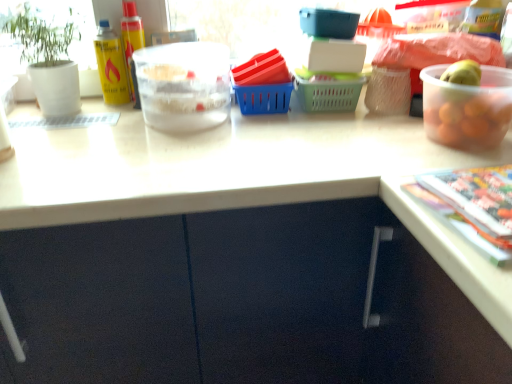
Question: From a real-world perspective, is transparent plastic bowl at upper right, placed as the first bowl when sorted from right to left, positioned under translucent plastic bowl at upper center, marked as the second bowl in a right-to-left arrangement, based on gravity?

Choices:
 (A) yes
 (B) no

Answer: (B)

Question: Is translucent plastic bowl at upper center, marked as the first bowl in a back-to-front arrangement, completely or partially inside transparent plastic bowl at upper right, the 1th bowl viewed from the front?

Choices:
 (A) yes
 (B) no

Answer: (B)

Question: Is transparent plastic bowl at upper right, which is the second bowl in back-to-front order, wider than translucent plastic bowl at upper center, marked as the second bowl in a right-to-left arrangement?

Choices:
 (A) yes
 (B) no

Answer: (B)

Question: Is transparent plastic bowl at upper right, which is the second bowl in back-to-front order, oriented towards translucent plastic bowl at upper center, acting as the 1th bowl starting from the left?

Choices:
 (A) no
 (B) yes

Answer: (A)

Question: Can we say transparent plastic bowl at upper right, the 1th bowl viewed from the front, lies outside translucent plastic bowl at upper center, marked as the first bowl in a back-to-front arrangement?

Choices:
 (A) yes
 (B) no

Answer: (A)

Question: Is transparent plastic bowl at upper right, placed as the first bowl when sorted from right to left, next to translucent plastic bowl at upper center, marked as the first bowl in a back-to-front arrangement?

Choices:
 (A) no
 (B) yes

Answer: (A)

Question: From the image's perspective, is green matte plant pot at left located above translucent plastic bowl at upper center, positioned as the 2th bowl in front-to-back order?

Choices:
 (A) yes
 (B) no

Answer: (A)

Question: Can you confirm if green matte plant pot at left is bigger than translucent plastic bowl at upper center, marked as the first bowl in a back-to-front arrangement?

Choices:
 (A) yes
 (B) no

Answer: (A)

Question: Does green matte plant pot at left appear on the left side of translucent plastic bowl at upper center, positioned as the 2th bowl in front-to-back order?

Choices:
 (A) no
 (B) yes

Answer: (B)

Question: Does green matte plant pot at left come in front of translucent plastic bowl at upper center, marked as the first bowl in a back-to-front arrangement?

Choices:
 (A) yes
 (B) no

Answer: (B)

Question: Considering the relative sizes of green matte plant pot at left and translucent plastic bowl at upper center, marked as the second bowl in a right-to-left arrangement, in the image provided, is green matte plant pot at left wider than translucent plastic bowl at upper center, marked as the second bowl in a right-to-left arrangement,?

Choices:
 (A) no
 (B) yes

Answer: (A)

Question: Considering the relative sizes of green matte plant pot at left and translucent plastic bowl at upper center, marked as the first bowl in a back-to-front arrangement, in the image provided, is green matte plant pot at left taller than translucent plastic bowl at upper center, marked as the first bowl in a back-to-front arrangement,?

Choices:
 (A) no
 (B) yes

Answer: (B)

Question: From the image's perspective, is translucent plastic bowl at upper center, marked as the second bowl in a right-to-left arrangement, on top of multicolored glossy magazine at lower right?

Choices:
 (A) no
 (B) yes

Answer: (B)